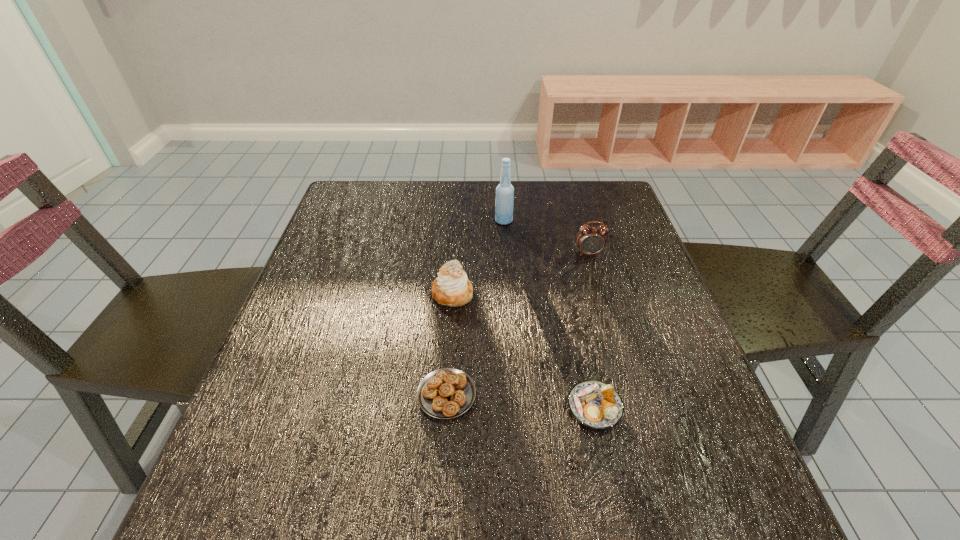
Locate which object ranks fourth in proximity to the alarm clock. Please provide its 2D coordinates. Your answer should be formatted as a tuple, i.e. [(x, y)], where the tuple contains the x and y coordinates of a point satisfying the conditions above.

[(446, 393)]

Point out which object is positioned as the nearest to the shortest object. Please provide its 2D coordinates. Your answer should be formatted as a tuple, i.e. [(x, y)], where the tuple contains the x and y coordinates of a point satisfying the conditions above.

[(452, 288)]

At what (x,y) coordinates should I click in order to perform the action: click on the closest pastry to the rightmost pastry. Please return your answer as a coordinate pair (x, y). Looking at the image, I should click on (446, 393).

Locate an element on the screen. pastry that can be found as the closest to the farthest pastry is located at coordinates (446, 393).

Identify the location of free space that satisfies the following two spatial constraints: 1. on the back side of the farthest pastry; 2. on the left side of the tallest object. This screenshot has width=960, height=540. coord(457,221).